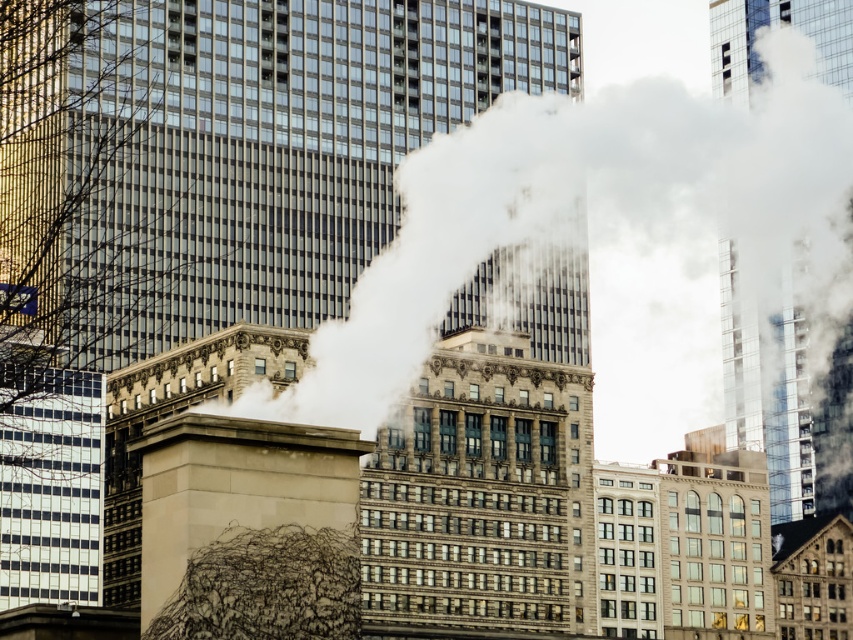
You are a city planner assessing the urban skyline. You notice the white smoke at center and the beige stone chimney at center. Which of these two objects has a larger visual footprint in the image?

The white smoke at center has a larger visual footprint than the beige stone chimney at center.

You are a city planner reviewing this urban scene. You notice the white smoke at center and the beige stone chimney at center. Which one is positioned to the right of the other?

The white smoke at center is to the right of the beige stone chimney at center.